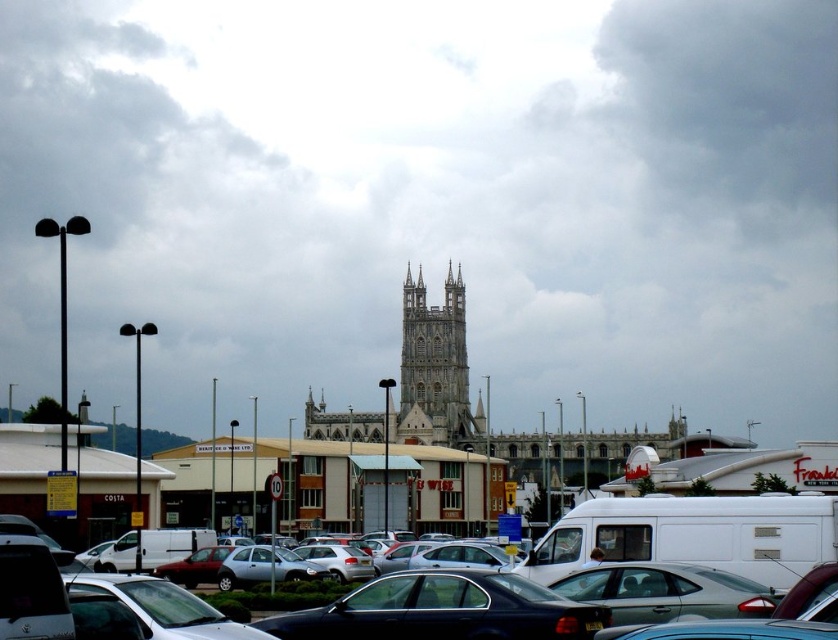
Is silver metallic sedan at center taller than metallic silver sedan at center?

Yes.

Between silver metallic sedan at center and metallic silver sedan at center, which one is positioned higher?

metallic silver sedan at center

Measure the distance between point (x=815, y=540) and camera.

Point (x=815, y=540) is 418.40 feet away from camera.

Identify the location of silver metallic sedan at center. The height and width of the screenshot is (640, 838). (702, 540).

Who is more forward, (437, 387) or (630, 570)?

Positioned in front is point (630, 570).

The image size is (838, 640). What are the coordinates of `white stone tower at center` in the screenshot? It's located at (433, 364).

Between silver metallic sedan at center and white stone tower at center, which one is positioned lower?

silver metallic sedan at center is lower down.

Is silver metallic sedan at center below white stone tower at center?

Indeed, silver metallic sedan at center is positioned under white stone tower at center.

Does point (709, 524) lie behind point (432, 394)?

No, (709, 524) is in front of (432, 394).

You are a GUI agent. You are given a task and a screenshot of the screen. Output one action in this format:
    pyautogui.click(x=<x>, y=<y>)
    Task: Click on the silver metallic sedan at center
    The width and height of the screenshot is (838, 640).
    Given the screenshot: What is the action you would take?
    pyautogui.click(x=702, y=540)